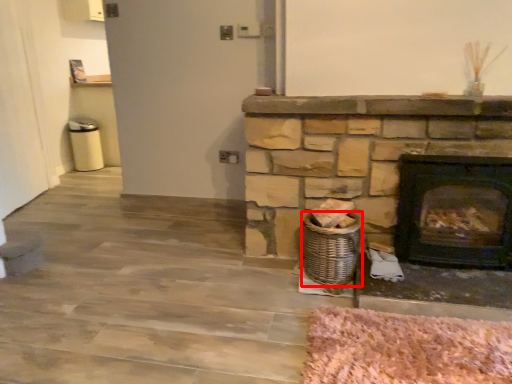
Question: From the image's perspective, where is basket (annotated by the red box) located relative to wood burning stove?

Choices:
 (A) above
 (B) below

Answer: (B)